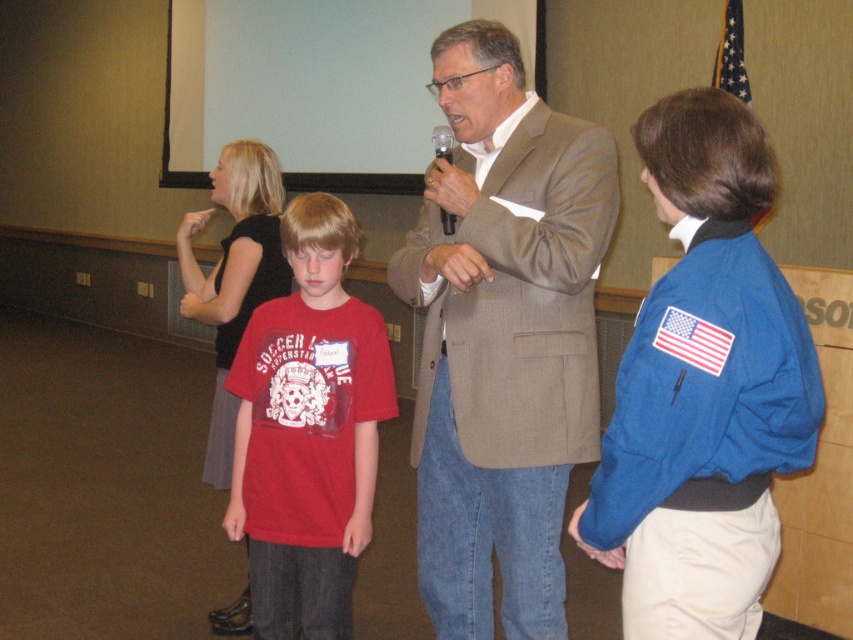
Identify the location of light brown textured suit at center. (503, 337).

Which is in front, point (439, 589) or point (334, 332)?

Point (439, 589) is in front.

Is point (425, 429) behind point (293, 336)?

No.

Where is `light brown textured suit at center`? The width and height of the screenshot is (853, 640). light brown textured suit at center is located at coordinates (503, 337).

Does light brown textured suit at center have a smaller size compared to black plastic microphone at center?

Incorrect, light brown textured suit at center is not smaller in size than black plastic microphone at center.

Measure the distance between light brown textured suit at center and black plastic microphone at center.

15.27 inches

Does point (463, 282) lie in front of point (448, 214)?

That is True.

This screenshot has width=853, height=640. I want to click on light brown textured suit at center, so click(x=503, y=337).

Can you confirm if matte red t-shirt at center is thinner than black plastic microphone at center?

No, matte red t-shirt at center is not thinner than black plastic microphone at center.

Can you confirm if matte red t-shirt at center is wider than black plastic microphone at center?

Correct, the width of matte red t-shirt at center exceeds that of black plastic microphone at center.

Is point (299, 374) positioned in front of point (436, 125)?

Yes, it is in front of point (436, 125).

The height and width of the screenshot is (640, 853). I want to click on matte red t-shirt at center, so click(x=308, y=429).